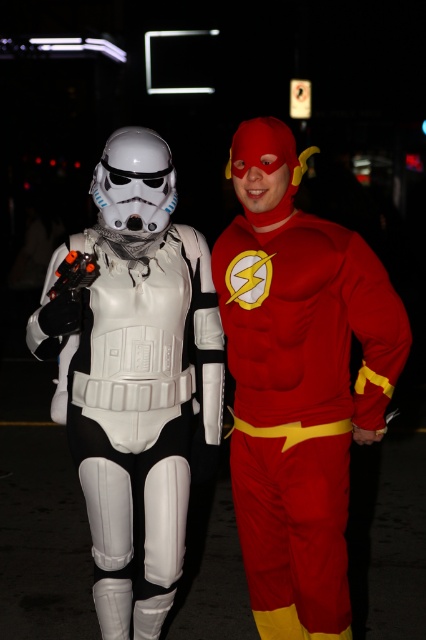
Is point (270, 131) more distant than point (310, 296)?

No, it is not.

In the scene shown: Does matte white armor at left appear over rubberized red suit at center?

Indeed, matte white armor at left is positioned over rubberized red suit at center.

Is point (129, 513) farther from camera compared to point (305, 301)?

Yes, point (129, 513) is farther from viewer.

At what (x,y) coordinates should I click in order to perform the action: click on matte white armor at left. Please return your answer as a coordinate pair (x, y). Looking at the image, I should click on (209, 381).

Is matte white armor at left thinner than white matte stormtrooper armor at left?

Incorrect, matte white armor at left's width is not less than white matte stormtrooper armor at left's.

Is matte white armor at left wider than white matte stormtrooper armor at left?

Indeed, matte white armor at left has a greater width compared to white matte stormtrooper armor at left.

Which is in front, point (365, 316) or point (152, 493)?

Point (365, 316) is more forward.

Find the location of a particular element. matte white armor at left is located at coordinates (209, 381).

Consider the image. Can you confirm if rubberized red suit at center is smaller than white matte stormtrooper armor at left?

Indeed, rubberized red suit at center has a smaller size compared to white matte stormtrooper armor at left.

Does rubberized red suit at center come in front of white matte stormtrooper armor at left?

Yes, it is.

Is point (287, 499) behind point (117, 552)?

No, (287, 499) is in front of (117, 552).

Find the location of a particular element. rubberized red suit at center is located at coordinates [x=302, y=406].